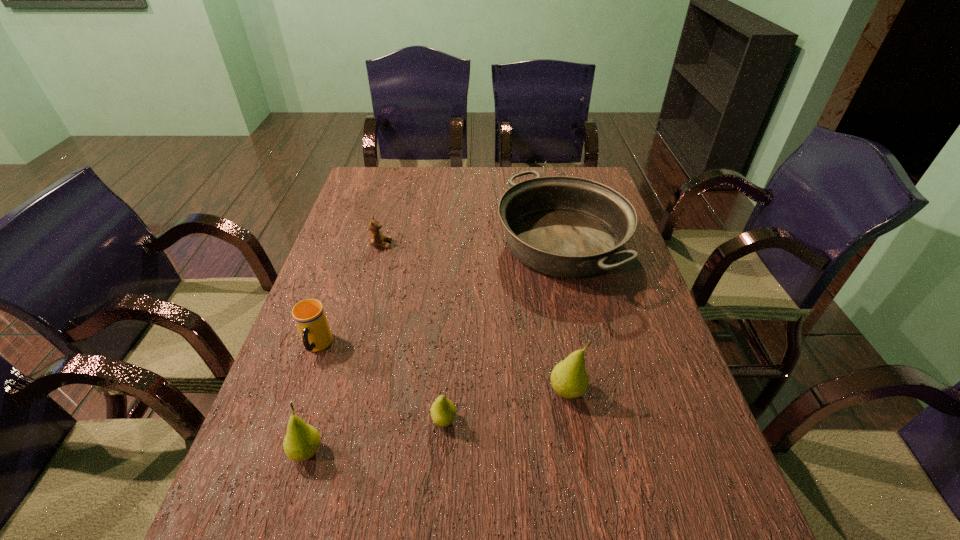
Locate an element on the screen. The height and width of the screenshot is (540, 960). empty space between the farthest pear and the teddy bear is located at coordinates (474, 318).

This screenshot has height=540, width=960. What are the coordinates of `unoccupied area between the pan and the tallest object` in the screenshot? It's located at (564, 318).

I want to click on vacant area that lies between the fifth farthest object and the pan, so (x=503, y=333).

Identify the location of empty space between the pan and the tallest object. The image size is (960, 540). (564, 318).

Locate an element on the screen. The image size is (960, 540). free space that is in between the pan and the leftmost pear is located at coordinates (434, 348).

The height and width of the screenshot is (540, 960). Identify the location of free space between the second pear from left to right and the tallest pear. (506, 406).

Find the location of a particular element. The width and height of the screenshot is (960, 540). free space that is in between the pan and the second tallest pear is located at coordinates (434, 348).

Select which object appears as the closest to the pan. Please provide its 2D coordinates. Your answer should be formatted as a tuple, i.e. [(x, y)], where the tuple contains the x and y coordinates of a point satisfying the conditions above.

[(569, 378)]

Select which object appears as the fourth closest to the pan. Please provide its 2D coordinates. Your answer should be formatted as a tuple, i.e. [(x, y)], where the tuple contains the x and y coordinates of a point satisfying the conditions above.

[(309, 315)]

Point out which pear is positioned as the nearest to the pan. Please provide its 2D coordinates. Your answer should be formatted as a tuple, i.e. [(x, y)], where the tuple contains the x and y coordinates of a point satisfying the conditions above.

[(569, 378)]